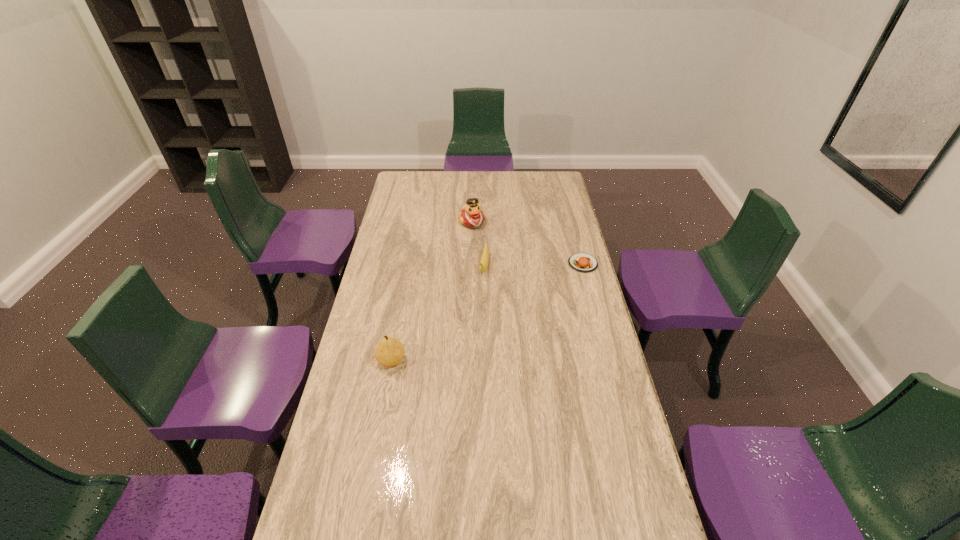
In order to click on vacant region between the farthest object and the third tallest object in this screenshot , I will do `click(478, 244)`.

Where is `vacant point located between the shortest object and the second shortest object`? The image size is (960, 540). vacant point located between the shortest object and the second shortest object is located at coordinates (534, 265).

At what (x,y) coordinates should I click in order to perform the action: click on free space between the shortest object and the farthest object. Please return your answer as a coordinate pair (x, y). Looking at the image, I should click on (527, 242).

Locate an element on the screen. vacant region between the banana and the rightmost object is located at coordinates tap(534, 265).

The height and width of the screenshot is (540, 960). What are the coordinates of `free space between the banana and the leftmost object` in the screenshot? It's located at (438, 314).

Where is `free point between the leftmost object and the duck`? The height and width of the screenshot is (540, 960). free point between the leftmost object and the duck is located at coordinates (432, 291).

The image size is (960, 540). Identify the location of empty location between the leftmost object and the shortest object. (x=487, y=312).

Find the location of a particular element. The image size is (960, 540). vacant area that lies between the duck and the leftmost object is located at coordinates (432, 291).

This screenshot has height=540, width=960. Find the location of `free area in between the farthest object and the banana`. free area in between the farthest object and the banana is located at coordinates (478, 244).

Find the location of a particular element. The width and height of the screenshot is (960, 540). unoccupied area between the leftmost object and the second shortest object is located at coordinates (438, 314).